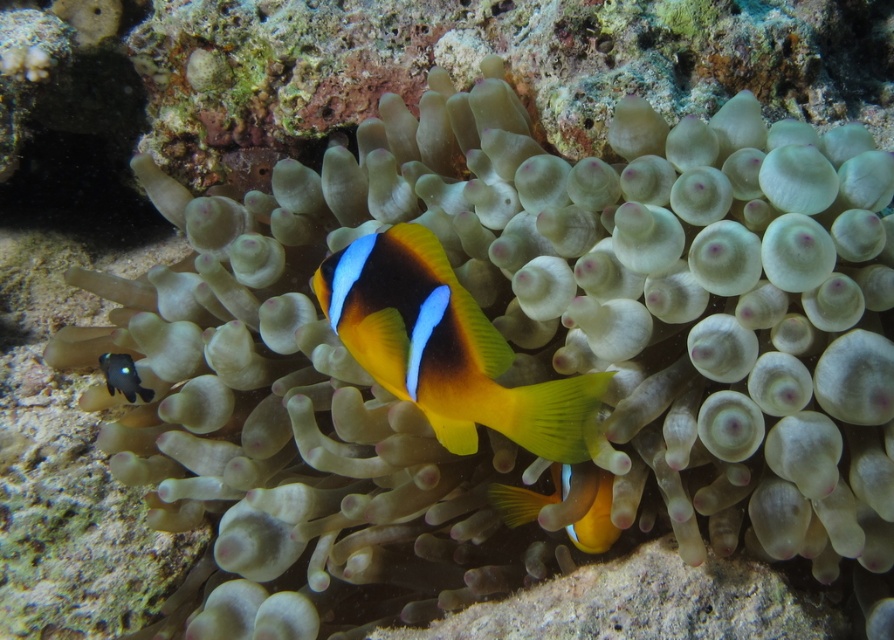
Looking at this image, who is higher up, shiny orange clownfish at center or shiny black rock at lower left?

shiny orange clownfish at center is above.

Does shiny orange clownfish at center appear on the right side of shiny black rock at lower left?

Correct, you'll find shiny orange clownfish at center to the right of shiny black rock at lower left.

Does point (402, 308) come farther from viewer compared to point (129, 369)?

No, (402, 308) is closer to viewer.

At what (x,y) coordinates should I click in order to perform the action: click on shiny orange clownfish at center. Please return your answer as a coordinate pair (x, y). The height and width of the screenshot is (640, 894). Looking at the image, I should click on (447, 348).

Who is higher up, shiny orange clownfish at center or yellow matte clownfish at center?

shiny orange clownfish at center is above.

Who is more distant from viewer, (398, 380) or (496, 509)?

Point (496, 509)

Where is `shiny orange clownfish at center`? shiny orange clownfish at center is located at coordinates (447, 348).

Is yellow matte clownfish at center to the left of shiny black rock at lower left from the viewer's perspective?

No, yellow matte clownfish at center is not to the left of shiny black rock at lower left.

Who is more forward, (x=578, y=532) or (x=148, y=400)?

Positioned in front is point (x=578, y=532).

Identify the location of yellow matte clownfish at center. The width and height of the screenshot is (894, 640). point(529,497).

Identify the location of yellow matte clownfish at center. (529, 497).